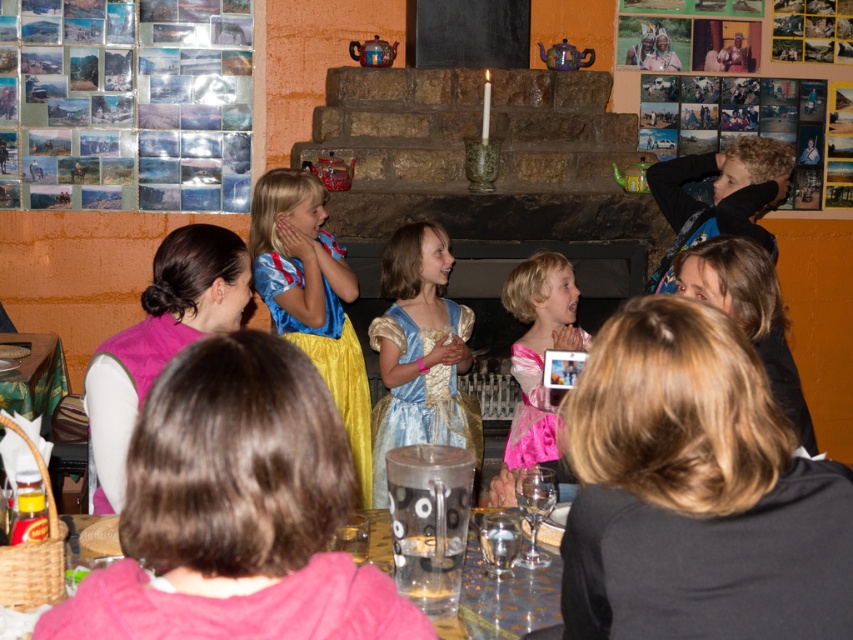
Question: Which object is closer to the camera taking this photo?

Choices:
 (A) pink satin dress at center
 (B) clear glass table at lower center
 (C) yellow satin dress at center

Answer: (B)

Question: Which of these objects is positioned farthest from the clear glass table at lower center?

Choices:
 (A) blue satin dress at center
 (B) black fabric at upper right

Answer: (A)

Question: Can you confirm if yellow satin dress at center is smaller than clear glass table at lower center?

Choices:
 (A) no
 (B) yes

Answer: (A)

Question: Can you confirm if pink satin dress at center is smaller than clear glass table at lower center?

Choices:
 (A) yes
 (B) no

Answer: (B)

Question: Estimate the real-world distances between objects in this image. Which object is farther from the pink satin dress at center?

Choices:
 (A) blue satin dress at center
 (B) yellow satin dress at center

Answer: (B)

Question: Observing the image, what is the correct spatial positioning of black fabric at upper right in reference to pink satin dress at center?

Choices:
 (A) left
 (B) right

Answer: (A)